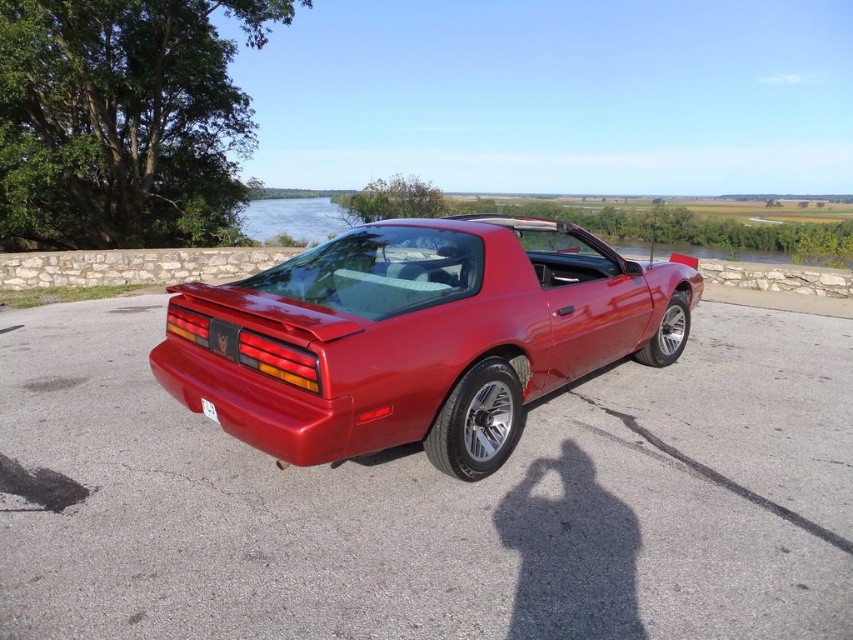
Is point (196, 397) positioned before point (209, 406)?

That is False.

This screenshot has width=853, height=640. Find the location of `glossy metallic car at center`. glossy metallic car at center is located at coordinates (416, 337).

Between point (311, 456) and point (209, 413), which one is positioned behind?

Positioned behind is point (209, 413).

The height and width of the screenshot is (640, 853). What are the coordinates of `glossy metallic car at center` in the screenshot? It's located at point(416,337).